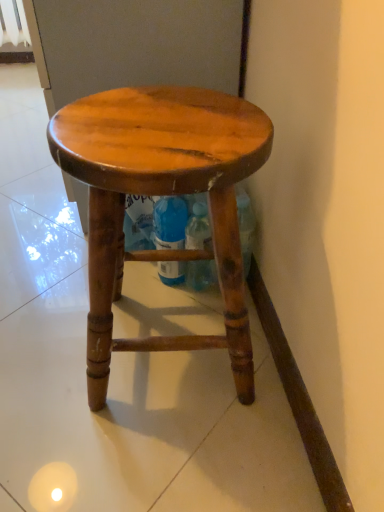
This screenshot has height=512, width=384. I want to click on vacant space in front of wooden stool at center, so pyautogui.click(x=160, y=452).